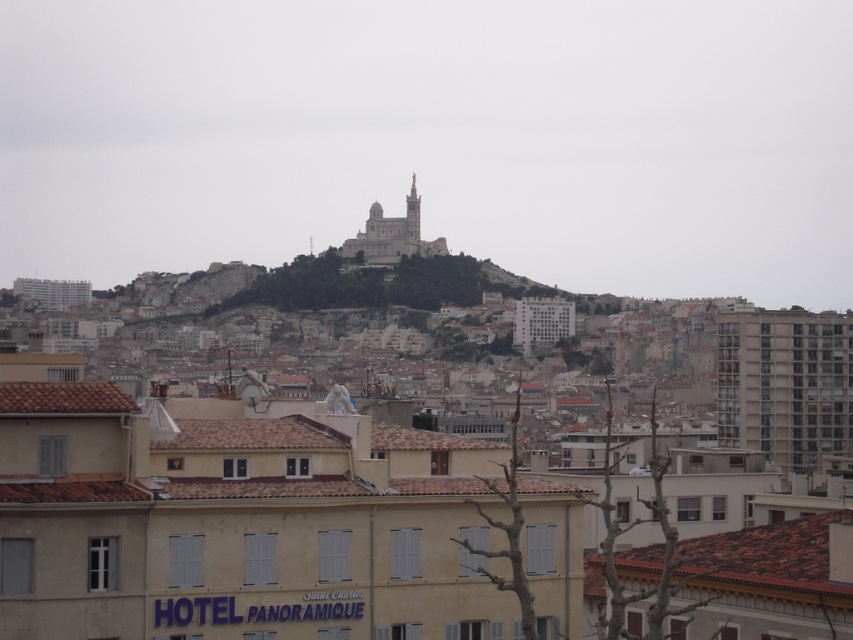
Question: Which point is closer to the camera?

Choices:
 (A) white stone church at upper center
 (B) gray concrete building at right

Answer: (B)

Question: Is gray concrete building at right to the left of white stone church at upper center from the viewer's perspective?

Choices:
 (A) yes
 (B) no

Answer: (B)

Question: Which object appears farthest from the camera in this image?

Choices:
 (A) gray concrete building at right
 (B) white stone church at upper center

Answer: (B)

Question: Is gray concrete building at right behind white stone church at upper center?

Choices:
 (A) no
 (B) yes

Answer: (A)

Question: Can you confirm if gray concrete building at right is positioned above white stone church at upper center?

Choices:
 (A) no
 (B) yes

Answer: (A)